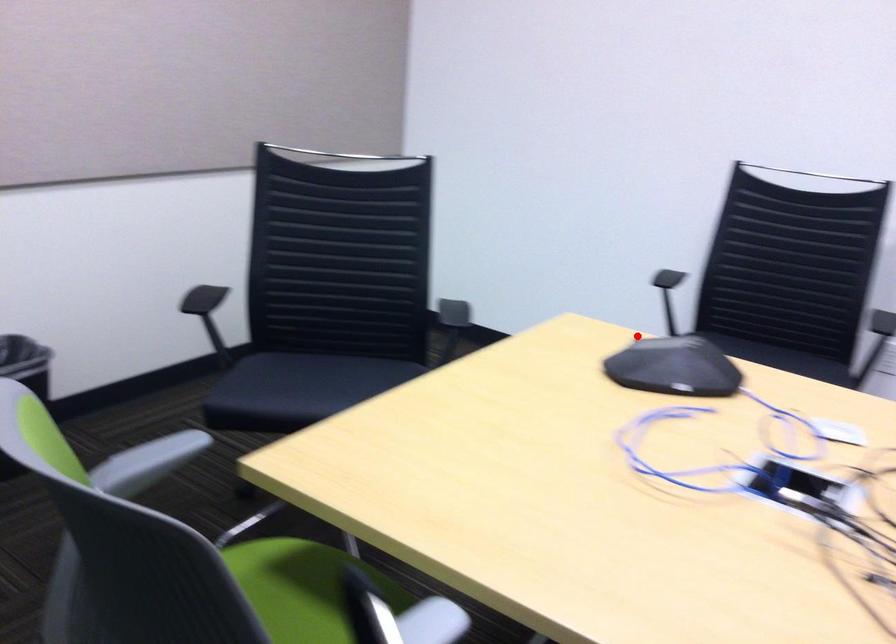
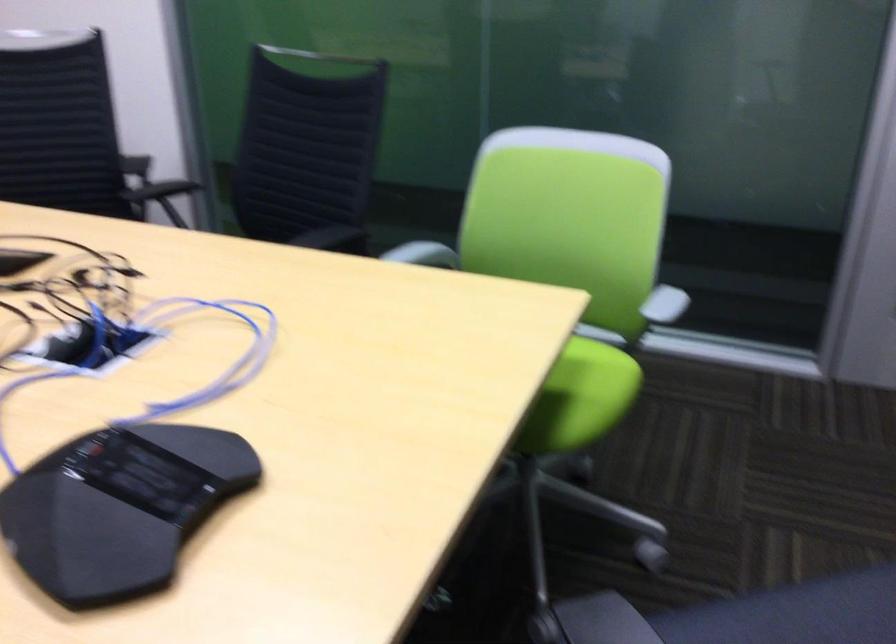
In the second image, find the point that corresponds to the highlighted location in the first image.

(119, 507)